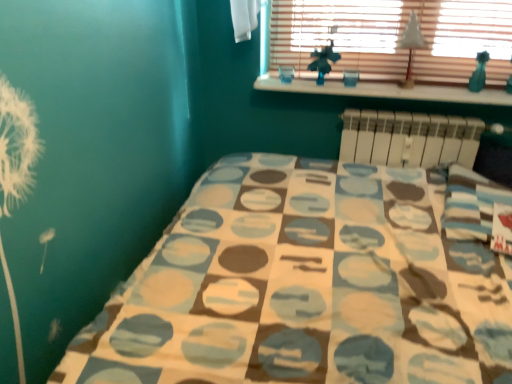
Question: Is wooden blinds at upper center thinner than white paper at upper center?

Choices:
 (A) no
 (B) yes

Answer: (B)

Question: Is white paper at upper center surrounded by wooden blinds at upper center?

Choices:
 (A) yes
 (B) no

Answer: (B)

Question: Is wooden blinds at upper center smaller than white paper at upper center?

Choices:
 (A) yes
 (B) no

Answer: (B)

Question: Does wooden blinds at upper center come in front of white paper at upper center?

Choices:
 (A) no
 (B) yes

Answer: (B)

Question: Is wooden blinds at upper center with white paper at upper center?

Choices:
 (A) no
 (B) yes

Answer: (A)

Question: From the image's perspective, is white paper at upper center located above or below wooden blinds at upper center?

Choices:
 (A) below
 (B) above

Answer: (A)

Question: Does point (401, 48) appear closer or farther from the camera than point (433, 76)?

Choices:
 (A) closer
 (B) farther

Answer: (A)

Question: In terms of width, does white paper at upper center look wider or thinner when compared to wooden blinds at upper center?

Choices:
 (A) wide
 (B) thin

Answer: (A)

Question: Choose the correct answer: Is white paper at upper center inside wooden blinds at upper center or outside it?

Choices:
 (A) outside
 (B) inside

Answer: (A)

Question: Considering the positions of white wood at upper center and white plastic radiator at upper right in the image, is white wood at upper center taller or shorter than white plastic radiator at upper right?

Choices:
 (A) short
 (B) tall

Answer: (A)

Question: From a real-world perspective, relative to white plastic radiator at upper right, is white wood at upper center vertically above or below?

Choices:
 (A) above
 (B) below

Answer: (A)

Question: In the image, is white wood at upper center on the left side or the right side of white plastic radiator at upper right?

Choices:
 (A) left
 (B) right

Answer: (A)

Question: In terms of size, does white wood at upper center appear bigger or smaller than white plastic radiator at upper right?

Choices:
 (A) small
 (B) big

Answer: (A)

Question: Is white plastic radiator at upper right wider or thinner than white wood at upper center?

Choices:
 (A) wide
 (B) thin

Answer: (B)

Question: Is white plastic radiator at upper right bigger or smaller than white wood at upper center?

Choices:
 (A) small
 (B) big

Answer: (B)